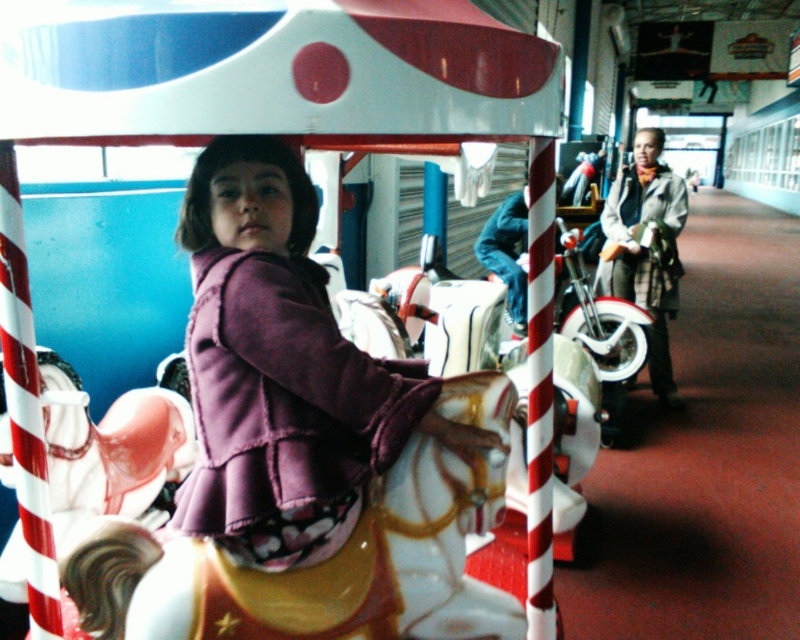
Does purple fleece jacket at center lie in front of shiny chrome motorcycle at center?

Yes, it is in front of shiny chrome motorcycle at center.

Does point (280, 248) come in front of point (592, 381)?

Yes, point (280, 248) is closer to viewer.

Image resolution: width=800 pixels, height=640 pixels. Find the location of `purple fleece jacket at center`. purple fleece jacket at center is located at coordinates (282, 371).

Locate an element on the screen. purple fleece jacket at center is located at coordinates (282, 371).

Is shiny metallic motorcycle at center positioned at the back of shiny chrome motorcycle at center?

No.

Find the location of a particular element. shiny metallic motorcycle at center is located at coordinates (316, 570).

Find the location of a particular element. shiny metallic motorcycle at center is located at coordinates (316, 570).

Is purple fleece jacket at center behind shiny metallic motorcycle at center?

No.

Between purple fleece jacket at center and shiny metallic motorcycle at center, which one is positioned higher?

purple fleece jacket at center

You are a GUI agent. You are given a task and a screenshot of the screen. Output one action in this format:
    pyautogui.click(x=<x>, y=<y>)
    Task: Click on the purple fleece jacket at center
    
    Given the screenshot: What is the action you would take?
    pyautogui.click(x=282, y=371)